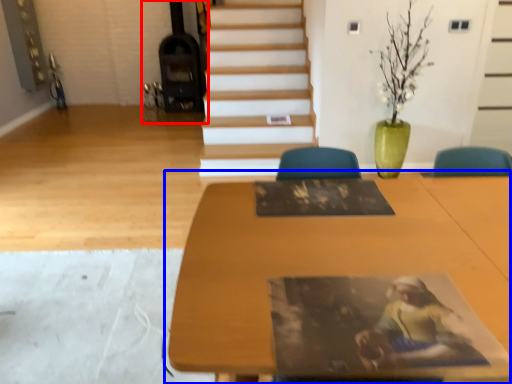
Question: Which object appears closest to the camera in this image, fireplace (highlighted by a red box) or table (highlighted by a blue box)?

Choices:
 (A) fireplace
 (B) table

Answer: (B)